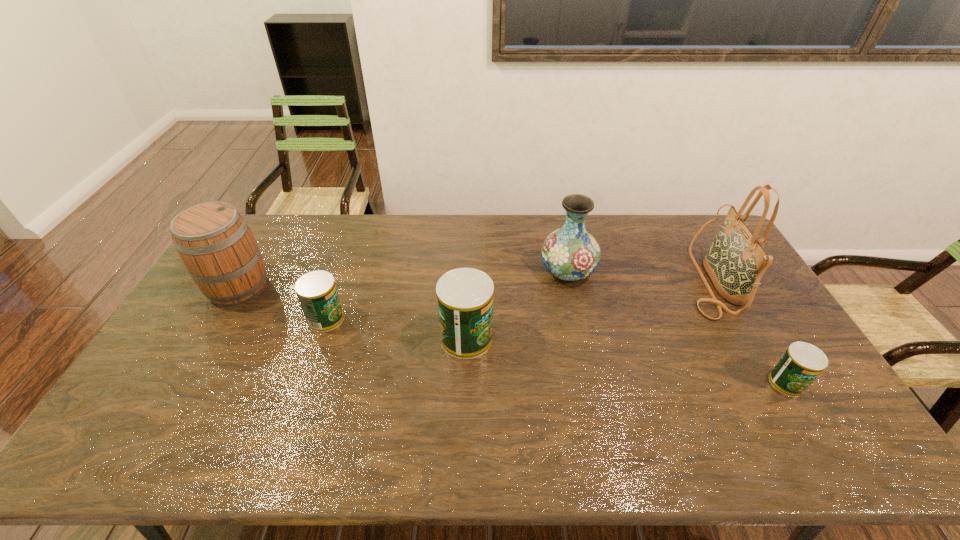
Find the location of a particular element. This screenshot has width=960, height=540. vacant space that satisfies the following two spatial constraints: 1. on the front-facing side of the handbag; 2. on the front side of the cider is located at coordinates (714, 288).

The image size is (960, 540). I want to click on vacant space that satisfies the following two spatial constraints: 1. on the front side of the shortest can; 2. on the left side of the vase, so click(591, 383).

Where is `blank space that satisfies the following two spatial constraints: 1. on the front-facing side of the tallest object; 2. on the front side of the second object from left to right`? This screenshot has width=960, height=540. blank space that satisfies the following two spatial constraints: 1. on the front-facing side of the tallest object; 2. on the front side of the second object from left to right is located at coordinates (732, 319).

The width and height of the screenshot is (960, 540). I want to click on vacant space that satisfies the following two spatial constraints: 1. on the back side of the leftmost object; 2. on the left side of the third object from right to left, so (x=248, y=271).

This screenshot has width=960, height=540. I want to click on vacant position in the image that satisfies the following two spatial constraints: 1. on the front side of the fourth tallest object; 2. on the left side of the leftmost object, so click(210, 338).